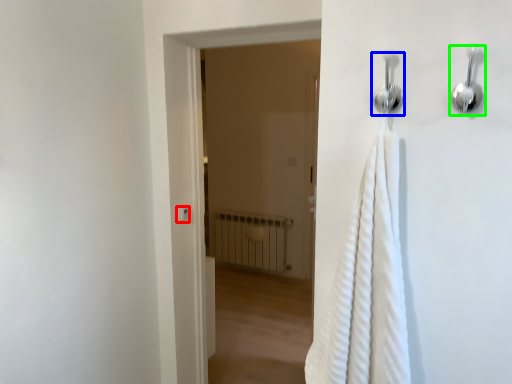
Question: Which is farther away from light switch (highlighted by a red box)? shower (highlighted by a blue box) or shower (highlighted by a green box)?

Choices:
 (A) shower
 (B) shower

Answer: (B)